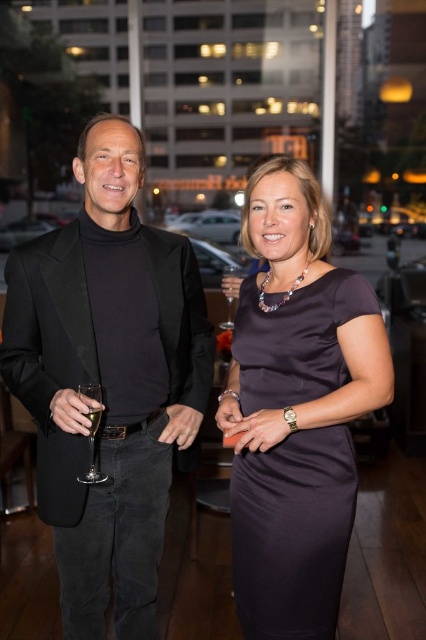
This screenshot has height=640, width=426. In order to click on black satin suit at left in this screenshot , I will do coord(108,380).

Can you confirm if black satin suit at left is positioned to the left of clear glass wine glass at left?

Incorrect, black satin suit at left is not on the left side of clear glass wine glass at left.

Locate an element on the screen. This screenshot has width=426, height=640. black satin suit at left is located at coordinates (108, 380).

Can you confirm if satin dress at center is taller than clear glass wine glass at left?

Yes, satin dress at center is taller than clear glass wine glass at left.

Find the location of `satin dress at center`. satin dress at center is located at coordinates (293, 532).

Looking at this image, is clear glass wine glass at center bigger than clear glass wine at center?

Yes.

Which of these two, clear glass wine glass at center or clear glass wine at center, stands taller?

With more height is clear glass wine glass at center.

Is point (227, 280) positioned before point (94, 419)?

That is False.

You are a GUI agent. You are given a task and a screenshot of the screen. Output one action in this format:
    pyautogui.click(x=<x>, y=<y>)
    Task: Click on the clear glass wine glass at center
    
    Given the screenshot: What is the action you would take?
    pyautogui.click(x=230, y=294)